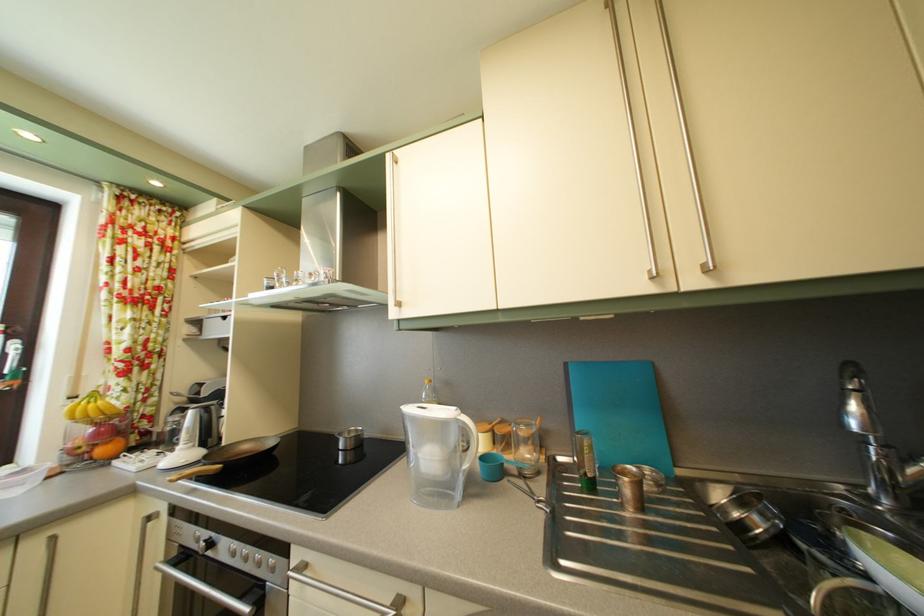
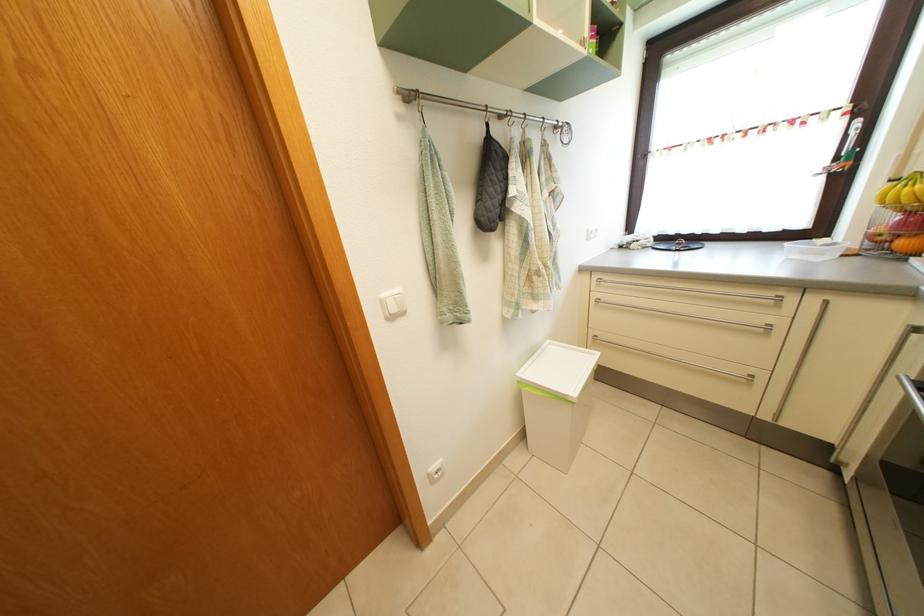
Find the pixel in the second image that matches (111,458) in the first image.

(910, 252)